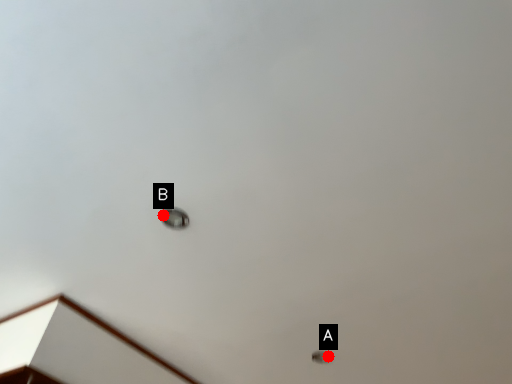
Question: Two points are circled on the image, labeled by A and B beside each circle. Which of the following is the closest to the observer?

Choices:
 (A) A is closer
 (B) B is closer

Answer: (B)